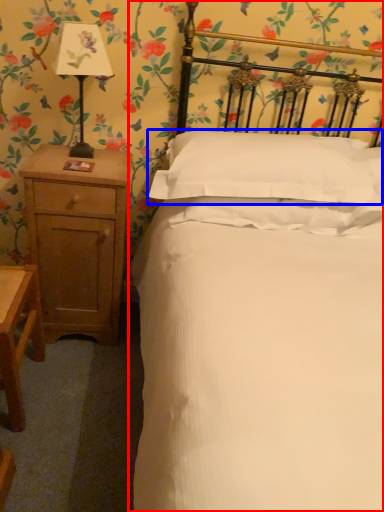
Question: Which point is further to the camera, bed (highlighted by a red box) or pillow (highlighted by a blue box)?

Choices:
 (A) bed
 (B) pillow

Answer: (B)